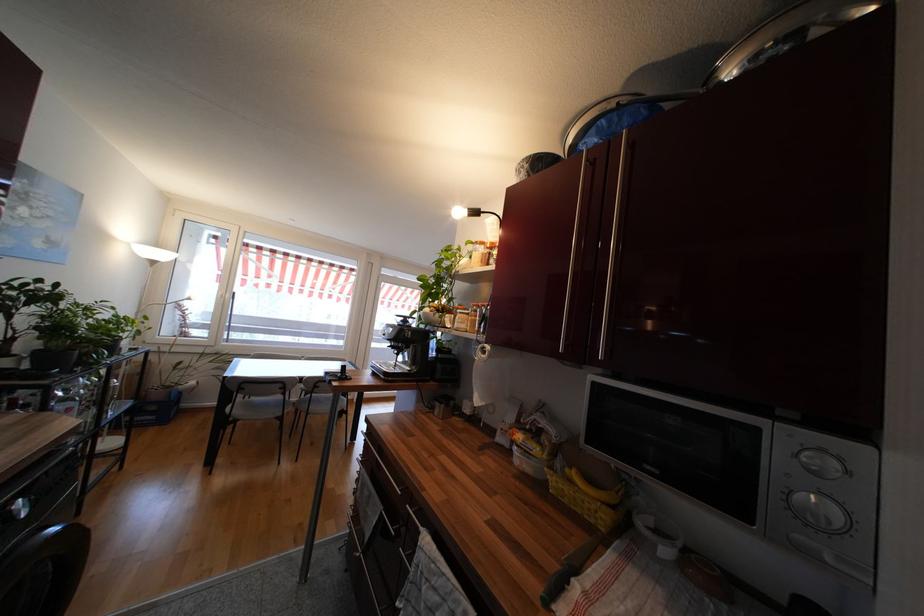
Find the location of a particular element. silver microwave dial is located at coordinates (820, 512).